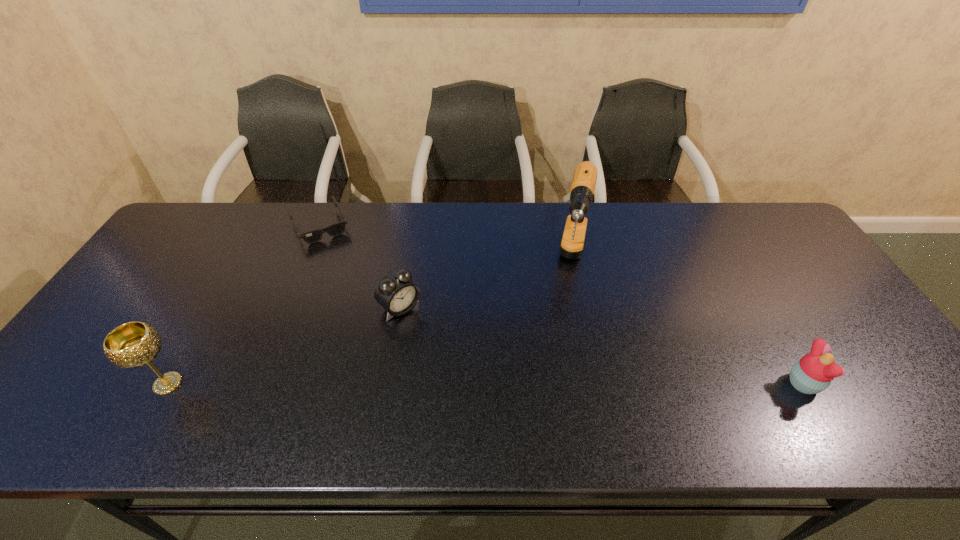
Where is `vacant space positioned 0.100m on the front side of the third object from left to right`? The image size is (960, 540). vacant space positioned 0.100m on the front side of the third object from left to right is located at coordinates (439, 341).

The height and width of the screenshot is (540, 960). In order to click on blank area located on the front side of the third object from left to right in this screenshot , I will do `click(441, 343)`.

Identify the location of vacant space located on the front side of the third object from left to right. The image size is (960, 540). (433, 337).

Locate an element on the screen. Image resolution: width=960 pixels, height=540 pixels. vacant point located 0.330m on the temples of the sunglasses is located at coordinates (361, 316).

The image size is (960, 540). What are the coordinates of `free space located on the temples of the sunglasses` in the screenshot? It's located at (344, 279).

In order to click on blank area located 0.350m on the temples of the sunglasses in this screenshot , I will do click(363, 322).

In order to click on free location located at the tip of the tallest object in this screenshot , I will do 567,347.

Find the location of `vacant space situated 0.080m at the tip of the tallest object`. vacant space situated 0.080m at the tip of the tallest object is located at coordinates (572, 323).

Find the location of a particular element. The width and height of the screenshot is (960, 540). vacant region located 0.050m at the tip of the tallest object is located at coordinates (573, 315).

The width and height of the screenshot is (960, 540). In order to click on sunglasses present at the far edge in this screenshot , I will do `click(314, 236)`.